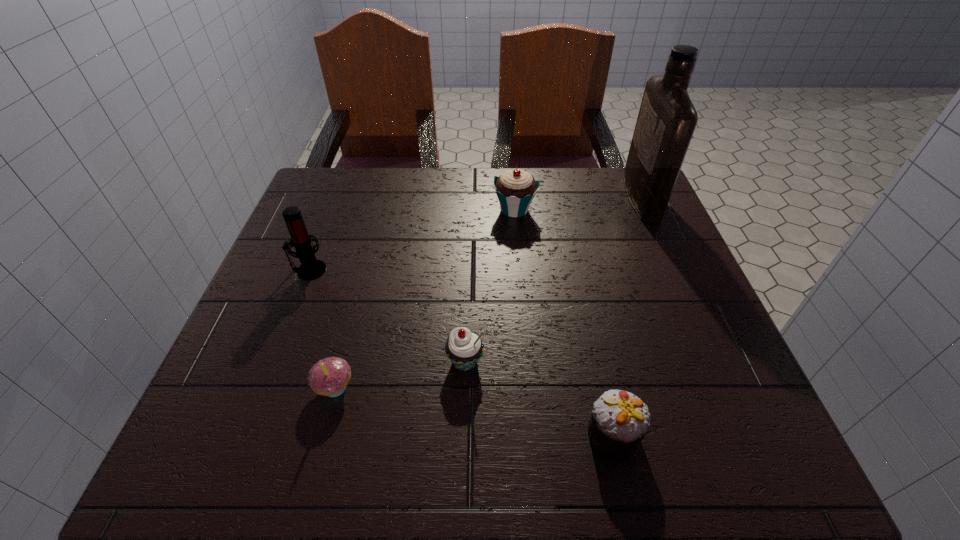
What are the coordinates of `liquor` in the screenshot? It's located at (667, 118).

You are a GUI agent. You are given a task and a screenshot of the screen. Output one action in this format:
    pyautogui.click(x=<x>, y=<y>)
    Task: Click on the tallest object
    The image size is (960, 540).
    Given the screenshot: What is the action you would take?
    pyautogui.click(x=667, y=118)

Locate an element on the screen. This screenshot has height=540, width=960. the leftmost object is located at coordinates click(310, 268).

This screenshot has height=540, width=960. What are the coordinates of `the fifth shortest object` in the screenshot? It's located at (310, 268).

Locate an element on the screen. the fourth object from left to right is located at coordinates (515, 189).

Locate an element on the screen. The width and height of the screenshot is (960, 540). the fourth shortest object is located at coordinates (515, 189).

At what (x,y) coordinates should I click in order to perform the action: click on the third object from left to right. Please return your answer as a coordinate pair (x, y). Looking at the image, I should click on (464, 348).

Locate an element on the screen. the second object from left to right is located at coordinates (329, 377).

The image size is (960, 540). Find the location of `the second object from right to left`. the second object from right to left is located at coordinates (620, 420).

Identify the location of the nearest object. tap(620, 420).